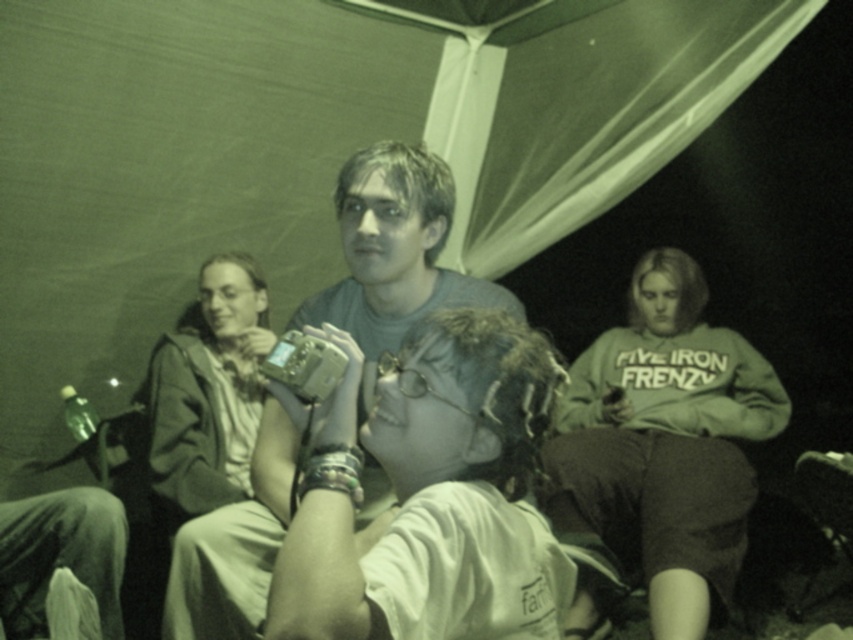
You are organizing a photo shoot and need to place the matte silver camera at center and the white cotton sweatshirt at right on a shelf. If the shelf has a width of 1 meter, can both items fit side by side without overlapping?

The matte silver camera at center has a lesser width compared to white cotton sweatshirt at right. However, since the total width of both items combined is not provided, it is impossible to determine if they can fit on a 1 meter shelf without overlapping.

You are standing inside the tent and want to move from point A at point (x=587, y=628) to point B at point (x=410, y=168). Which point is closer to you when you start at point A?

Point A at point (x=587, y=628) is closer to you because you are already at point A. However, if you move from point A to point B, point B at point (x=410, y=168) will be the destination. Since the question asks which is closer when starting at point A, the answer is that you are already at point A, so it is the closest.

You are standing in the tent and want to take a photo of the white cotton sweatshirt at right without moving it. Can you use the matte silver camera at center to do this? Explain why or why not.

The matte silver camera at center is positioned over the white cotton sweatshirt at right, so yes, you can use the matte silver camera at center to take a photo of the white cotton sweatshirt at right without moving it because the camera is already above it and has a clear line of sight.